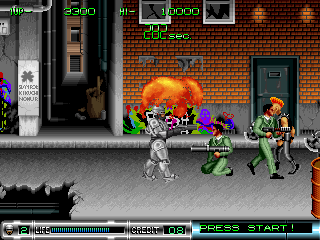
Identify the location of door. (280, 85).